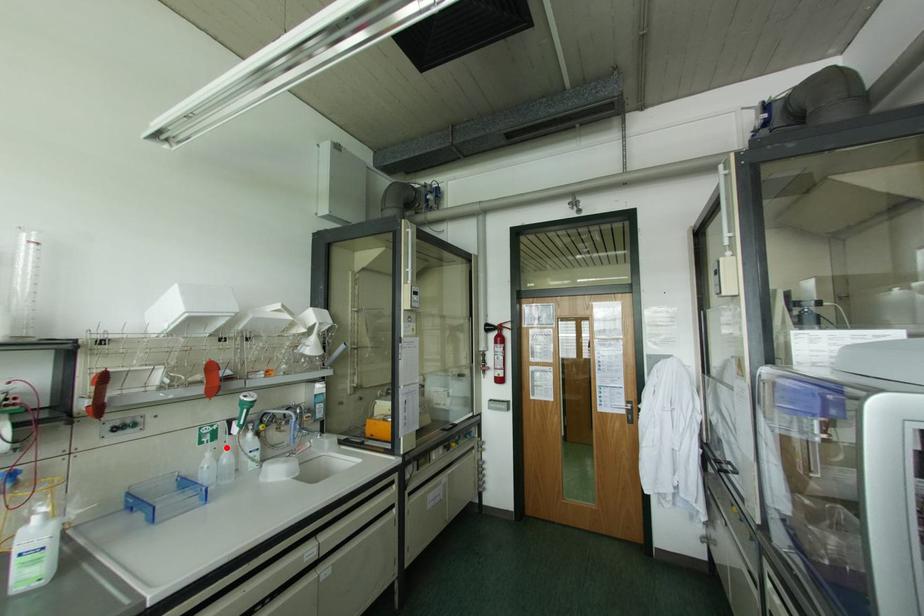
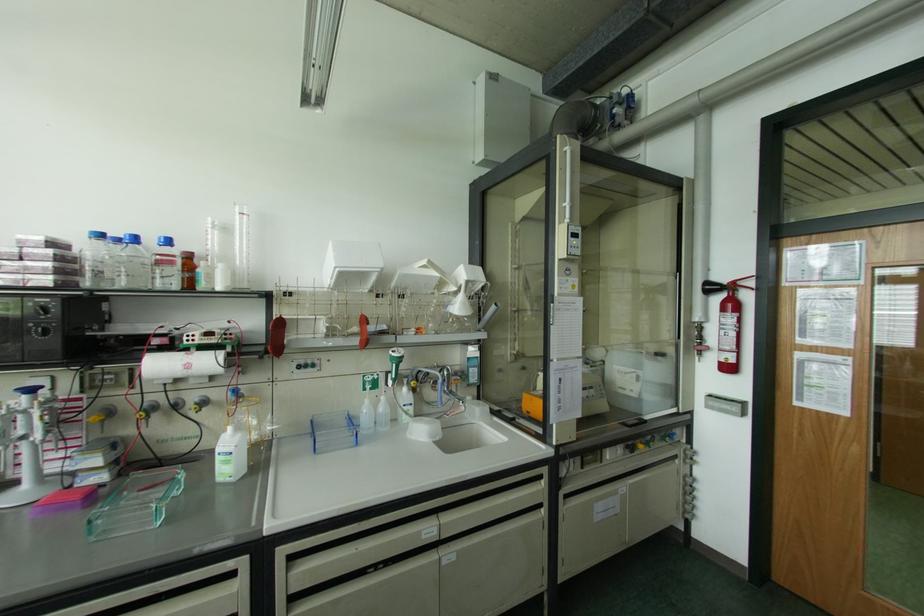
Question: I am providing you with two images of the same scene from different viewpoints. Image1 has a red point marked. In image2, the corresponding 3D location appears at what relative position? Reply with the corresponding letter.

Choices:
 (A) Closer
 (B) Farther

Answer: (B)